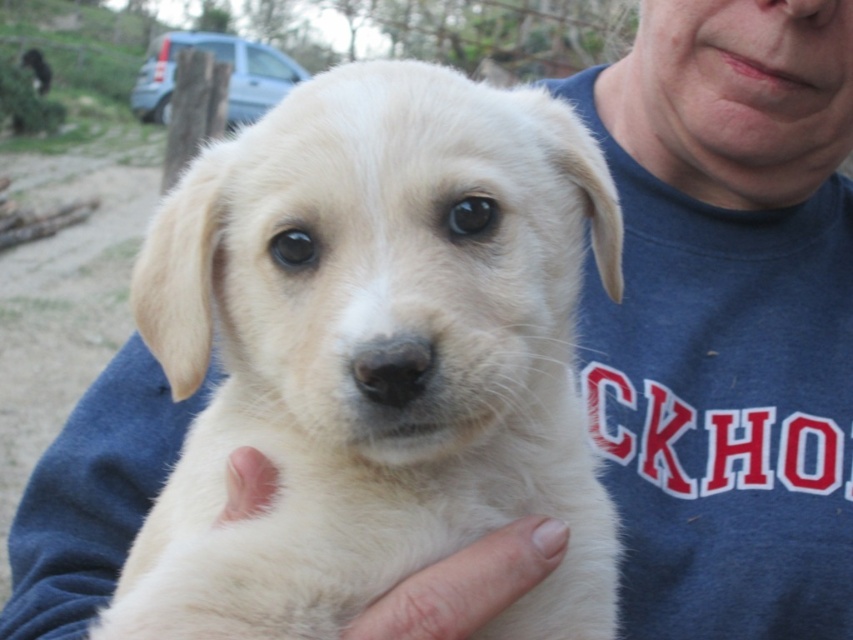
Who is shorter, white fur dog at center or white soft fur at lower center?

With less height is white soft fur at lower center.

Looking at this image, is white fur dog at center below white soft fur at lower center?

Actually, white fur dog at center is above white soft fur at lower center.

Where is `white fur dog at center`? white fur dog at center is located at coordinates (375, 355).